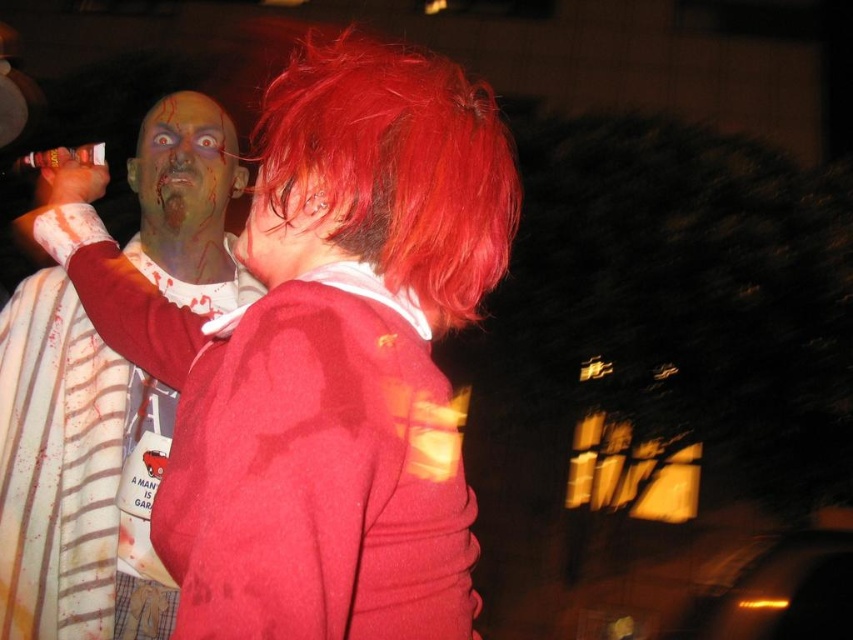
You are a photographer setting up for a Halloween photoshoot. You have two props to place in the scene. The matte red wig at upper center and the matte white shirt at left. You want to arrange them so that the shorter object is placed in the foreground. Which prop should you choose?

The matte red wig at upper center is not as tall as the matte white shirt at left, so the shorter object is the matte red wig at upper center. Place the matte red wig at upper center in the foreground.

You are a photographer setting up for a Halloween photoshoot. You need to position two props, the matte red wig at upper center and the matte white shirt at left, such that they are exactly 30 inches apart. Given their current distance, do you need to move them closer or farther apart?

The matte red wig at upper center is currently 29.57 inches from the matte white shirt at left. Since 29.57 is slightly less than 30 inches, you need to move them slightly farther apart to reach the desired distance of 30 inches.